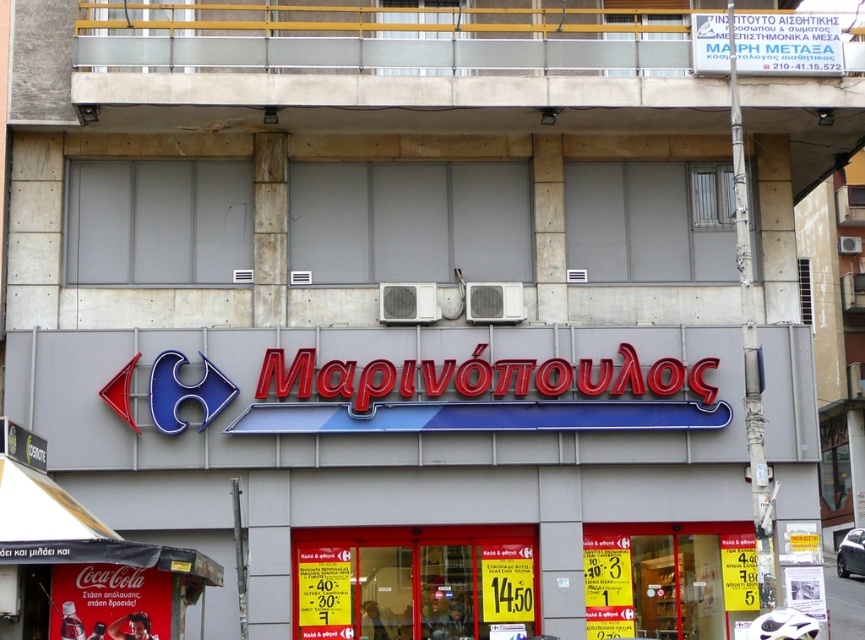
Is matte red coca-cola sign at lower left further to camera compared to white plastic sign at upper center?

No, it is in front of white plastic sign at upper center.

Between point (141, 566) and point (693, 32), which one is positioned in front?

Point (141, 566) is more forward.

At what (x,y) coordinates should I click in order to perform the action: click on matte red coca-cola sign at lower left. Please return your answer as a coordinate pair (x, y). The width and height of the screenshot is (865, 640). Looking at the image, I should click on (109, 602).

Can you confirm if white plastic sign at upper center is positioned above red plastic sign at center?

Yes.

Can you confirm if white plastic sign at upper center is positioned below red plastic sign at center?

No.

Is point (708, 61) farther from camera compared to point (594, 609)?

Yes, it is behind point (594, 609).

Identify the location of white plastic sign at upper center. (767, 44).

Who is shorter, matte red coca-cola sign at lower left or yellow paper sign at center?

With less height is matte red coca-cola sign at lower left.

Is matte red coca-cola sign at lower left bigger than yellow paper sign at center?

Correct, matte red coca-cola sign at lower left is larger in size than yellow paper sign at center.

Locate an element on the screen. This screenshot has height=640, width=865. matte red coca-cola sign at lower left is located at coordinates (109, 602).